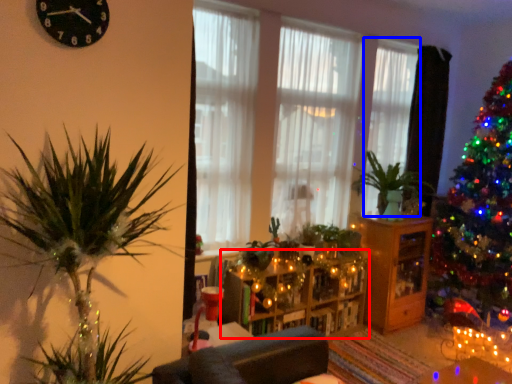
Question: Which of the following is the closest to the observer, entertainment center (highlighted by a red box) or curtain (highlighted by a blue box)?

Choices:
 (A) entertainment center
 (B) curtain

Answer: (A)